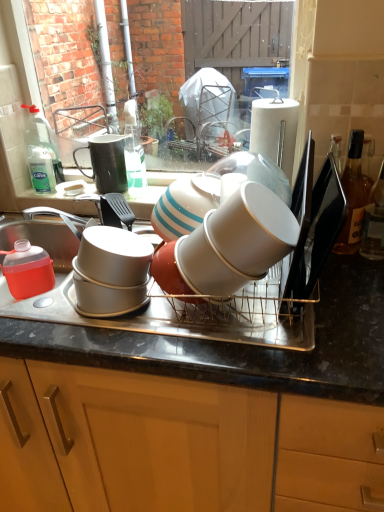
Question: Is translucent plastic jug at left, marked as the third tableware in a front-to-back arrangement, not inside white glossy cup at center, which is counted as the 4th tableware, starting from the left?

Choices:
 (A) yes
 (B) no

Answer: (A)

Question: Considering the relative sizes of translucent plastic jug at left, the 1th tableware positioned from the left, and white glossy cup at center, which appears as the first tableware when viewed from the front, in the image provided, is translucent plastic jug at left, the 1th tableware positioned from the left, taller than white glossy cup at center, which appears as the first tableware when viewed from the front,?

Choices:
 (A) no
 (B) yes

Answer: (A)

Question: Considering the relative sizes of translucent plastic jug at left, which is the second tableware from back to front, and white glossy cup at center, the 4th tableware from the back, in the image provided, is translucent plastic jug at left, which is the second tableware from back to front, smaller than white glossy cup at center, the 4th tableware from the back,?

Choices:
 (A) yes
 (B) no

Answer: (A)

Question: Can you confirm if translucent plastic jug at left, marked as the third tableware in a front-to-back arrangement, is positioned to the left of white glossy cup at center, positioned as the 1th tableware in right-to-left order?

Choices:
 (A) yes
 (B) no

Answer: (A)

Question: Are translucent plastic jug at left, marked as the third tableware in a front-to-back arrangement, and white glossy cup at center, positioned as the 1th tableware in right-to-left order, beside each other?

Choices:
 (A) yes
 (B) no

Answer: (B)

Question: Considering the relative positions of metallic gray tray at center and white glossy cup at center, which is counted as the 4th tableware, starting from the left, in the image provided, is metallic gray tray at center to the left or to the right of white glossy cup at center, which is counted as the 4th tableware, starting from the left,?

Choices:
 (A) left
 (B) right

Answer: (A)

Question: Choose the correct answer: Is metallic gray tray at center inside white glossy cup at center, the 4th tableware from the back, or outside it?

Choices:
 (A) inside
 (B) outside

Answer: (B)

Question: Does point (380, 294) appear closer or farther from the camera than point (286, 206)?

Choices:
 (A) closer
 (B) farther

Answer: (A)

Question: In terms of width, does metallic gray tray at center look wider or thinner when compared to white glossy cup at center, positioned as the 1th tableware in right-to-left order?

Choices:
 (A) wide
 (B) thin

Answer: (A)

Question: Considering the relative positions of matte black mug at upper center, which appears as the third tableware when viewed from the right, and white glossy cup at center, positioned as the second tableware in front-to-back order, in the image provided, is matte black mug at upper center, which appears as the third tableware when viewed from the right, to the left or to the right of white glossy cup at center, positioned as the second tableware in front-to-back order,?

Choices:
 (A) left
 (B) right

Answer: (A)

Question: Based on their sizes in the image, would you say matte black mug at upper center, which ranks as the 1th tableware in back-to-front order, is bigger or smaller than white glossy cup at center, the 3th tableware in the back-to-front sequence?

Choices:
 (A) big
 (B) small

Answer: (B)

Question: Considering the positions of matte black mug at upper center, the second tableware in the left-to-right sequence, and white glossy cup at center, the 2th tableware from the right, in the image, is matte black mug at upper center, the second tableware in the left-to-right sequence, taller or shorter than white glossy cup at center, the 2th tableware from the right,?

Choices:
 (A) tall
 (B) short

Answer: (B)

Question: Is point (102, 173) positioned closer to the camera than point (228, 291)?

Choices:
 (A) closer
 (B) farther

Answer: (B)

Question: From a real-world perspective, is translucent plastic jug at left, the fourth tableware from the right, positioned above or below metallic gray tray at center?

Choices:
 (A) below
 (B) above

Answer: (B)

Question: In terms of width, does translucent plastic jug at left, the fourth tableware from the right, look wider or thinner when compared to metallic gray tray at center?

Choices:
 (A) wide
 (B) thin

Answer: (B)